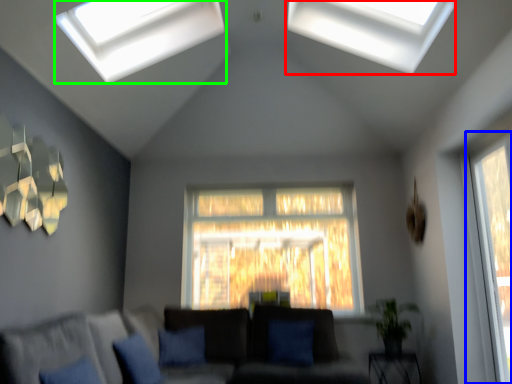
Question: Based on their relative distances, which object is nearer to window (highlighted by a red box)? Choose from window (highlighted by a blue box) and window (highlighted by a green box).

Choices:
 (A) window
 (B) window

Answer: (B)